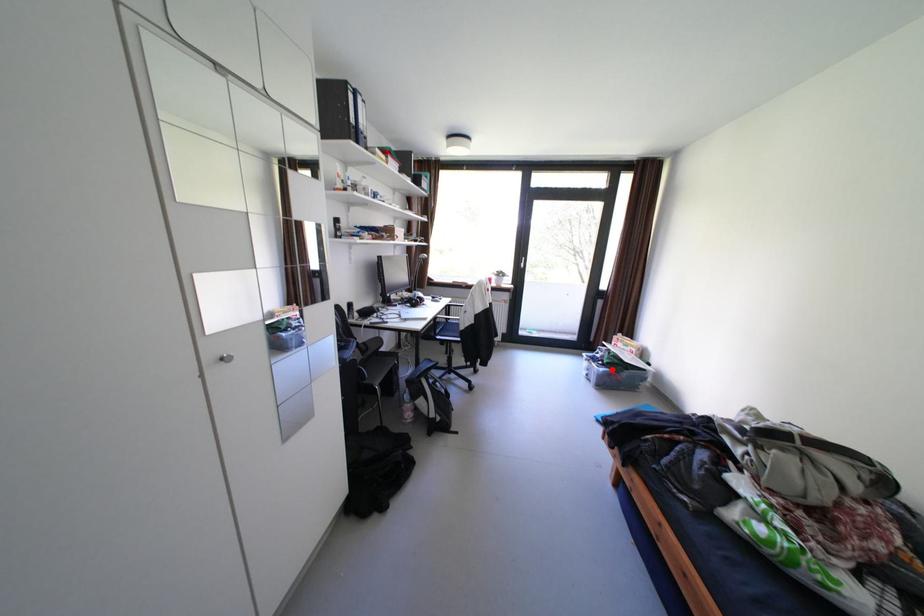
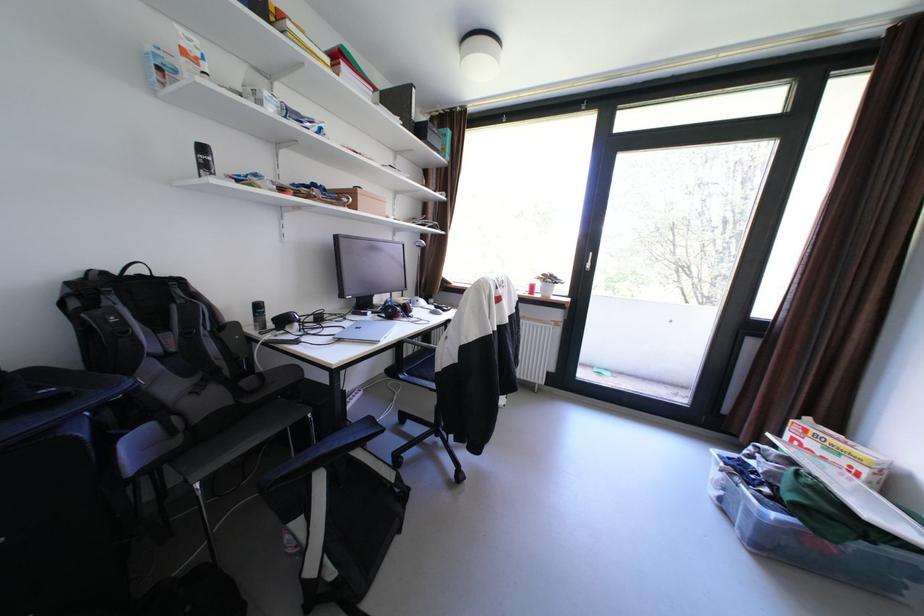
Question: I am providing you with two images of the same scene from different viewpoints. A red point is shown in image1. For the corresponding object point in image2, is it positioned nearer or farther from the camera?

Choices:
 (A) Nearer
 (B) Farther

Answer: (A)